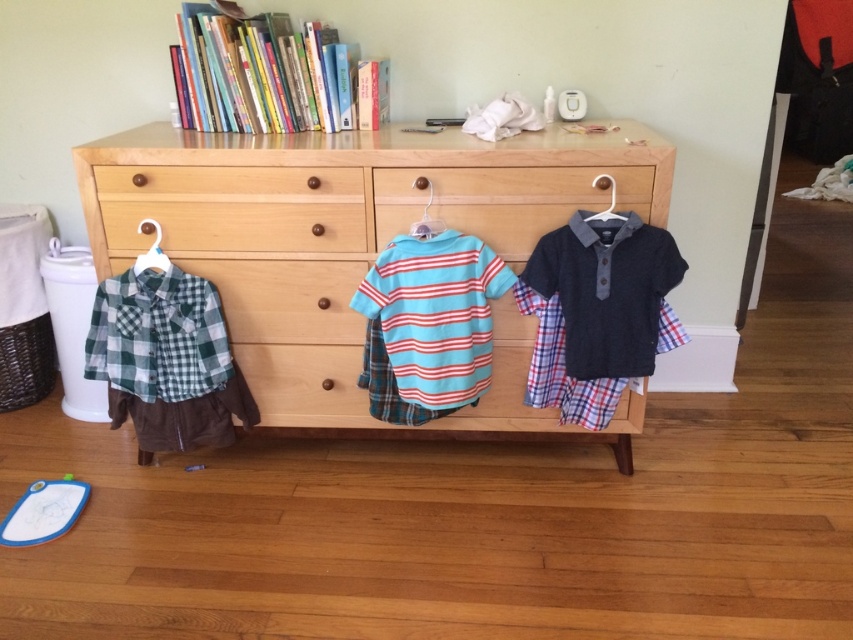
Is striped cotton shirt at center thinner than white plastic hanger at center?

Incorrect, striped cotton shirt at center's width is not less than white plastic hanger at center's.

Is striped cotton shirt at center shorter than white plastic hanger at center?

No, striped cotton shirt at center is not shorter than white plastic hanger at center.

Where is `striped cotton shirt at center`? The image size is (853, 640). striped cotton shirt at center is located at coordinates (428, 324).

Find the location of a particular element. The height and width of the screenshot is (640, 853). striped cotton shirt at center is located at coordinates (428, 324).

Between point (138, 422) and point (576, 376), which one is positioned behind?

Positioned behind is point (138, 422).

Between point (244, 413) and point (602, 236), which one is positioned behind?

Positioned behind is point (244, 413).

I want to click on green plaid shirt at left, so click(166, 360).

Which is behind, point (288, 227) or point (548, 371)?

The point (548, 371) is more distant.

Does wooden dresser at center have a smaller size compared to plaid cotton shirt at center?

No, wooden dresser at center is not smaller than plaid cotton shirt at center.

At what (x,y) coordinates should I click in order to perform the action: click on wooden dresser at center. Please return your answer as a coordinate pair (x, y). Looking at the image, I should click on (338, 227).